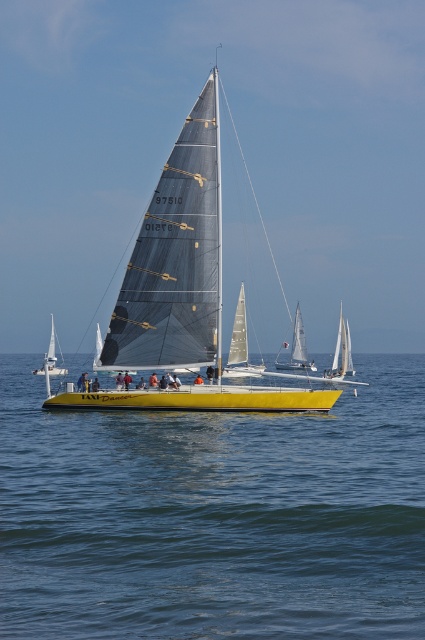
You are a photographer trying to capture the clear blue water at center and the white matte sailboat at lower left in a single shot. Based on their sizes in the image, which object would require you to adjust your camera settings to focus on a closer subject?

The clear blue water at center is smaller than the white matte sailboat at lower left, so you should focus on the white matte sailboat at lower left since it is closer and larger in the frame.

You are a photographer standing on the deck of the yellow sailboat named Taxi Dancer. You want to take a photo that includes both the clear blue water at center and the white matte sailboat at lower left. Which object should appear larger in your photo?

The clear blue water at center should appear larger in the photo because it is closer to the viewer than the white matte sailboat at lower left.

In the scene shown: You are a photographer positioned at the origin point of the image. The yellow matte sailboat at center is at coordinates 0.458, 0.424. If you want to capture a closeup of the sailboat without including any other boats in the background, which direction should you move your camera?

The yellow matte sailboat at center is located at point (180, 292). To capture a closeup without including other boats, move the camera closer to the sailboat along the line of sight towards its coordinates.